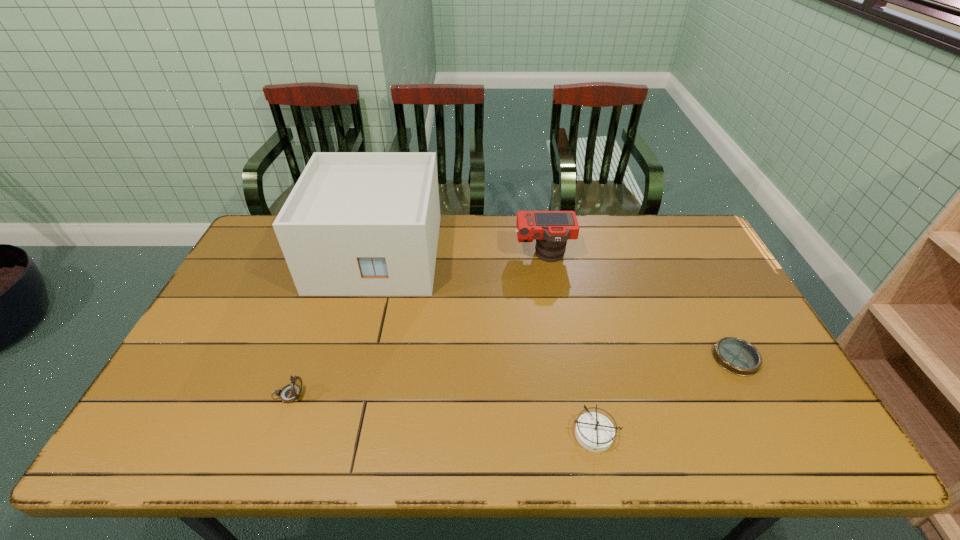
This screenshot has width=960, height=540. What are the coordinates of `free space located 0.290m on the face of the second farthest compass` in the screenshot? It's located at (420, 395).

The height and width of the screenshot is (540, 960). Identify the location of free point located on the right of the second shortest compass. (657, 434).

Where is `free point located on the front of the rightmost compass`? This screenshot has height=540, width=960. free point located on the front of the rightmost compass is located at coordinates (786, 456).

Identify the location of box located in the far edge section of the desktop. (356, 223).

This screenshot has width=960, height=540. Identify the location of camera that is at the far edge. (551, 229).

Where is `object that is at the near edge`? This screenshot has height=540, width=960. object that is at the near edge is located at coordinates (595, 432).

Identify the location of object that is at the right edge. The height and width of the screenshot is (540, 960). (737, 356).

Where is `vacant space at the far edge of the desktop`? vacant space at the far edge of the desktop is located at coordinates (581, 215).

In the image, there is a desktop. Where is `vacant area at the near edge`? The height and width of the screenshot is (540, 960). vacant area at the near edge is located at coordinates (737, 455).

Image resolution: width=960 pixels, height=540 pixels. In order to click on vacant space at the left edge in this screenshot , I will do `click(228, 326)`.